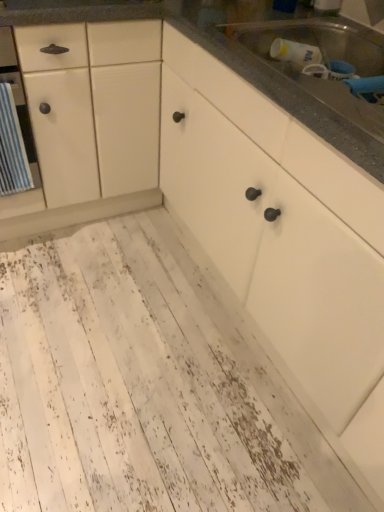
Question: Considering the positions of white distressed wood floor at lower left and white wood countertop at upper right in the image, is white distressed wood floor at lower left wider or thinner than white wood countertop at upper right?

Choices:
 (A) wide
 (B) thin

Answer: (A)

Question: In the image, is white distressed wood floor at lower left on the left side or the right side of white wood countertop at upper right?

Choices:
 (A) left
 (B) right

Answer: (B)

Question: Which is farther from the white wood countertop at upper right?

Choices:
 (A) metallic stainless steel sink at upper right
 (B) white distressed wood floor at lower left

Answer: (B)

Question: Based on their relative distances, which object is nearer to the white distressed wood floor at lower left?

Choices:
 (A) white wood countertop at upper right
 (B) metallic stainless steel sink at upper right

Answer: (A)